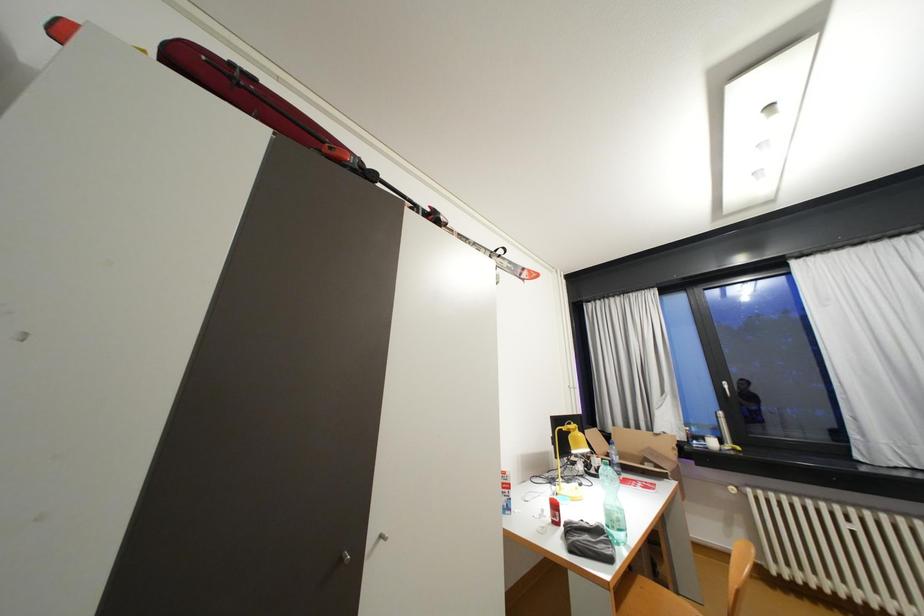
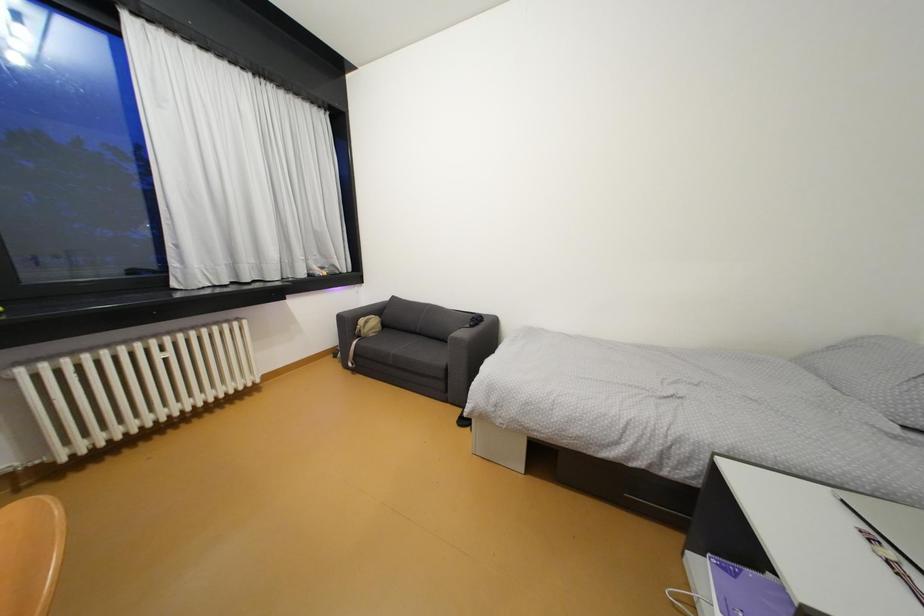
Question: The images are taken continuously from a first-person perspective. In which direction is your viewpoint rotating?

Choices:
 (A) Left
 (B) Right
 (C) Up
 (D) Down

Answer: (B)